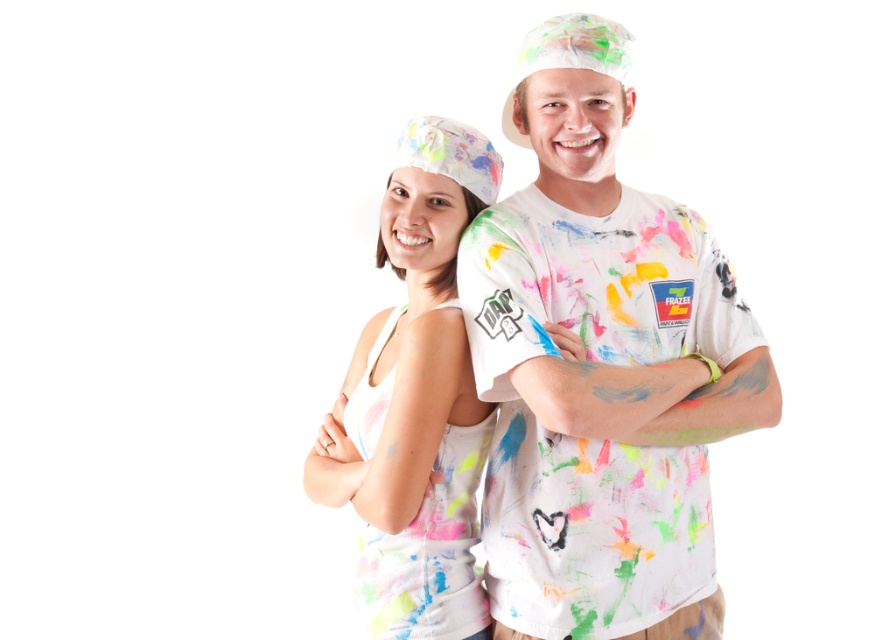
Looking at this image, you are a photographer trying to capture the paint splatters on the tshirt at the center of the image. The camera you are using has a focus point at coordinate point (x=601, y=365). Will this focus point be effective for capturing the paint splatters on the paint splattered tshirt at center?

The paint splattered tshirt at center is represented by point (x=601, y=365), so the focus point at coordinate point (x=601, y=365) will be effective for capturing the paint splatters on the paint splattered tshirt at center.